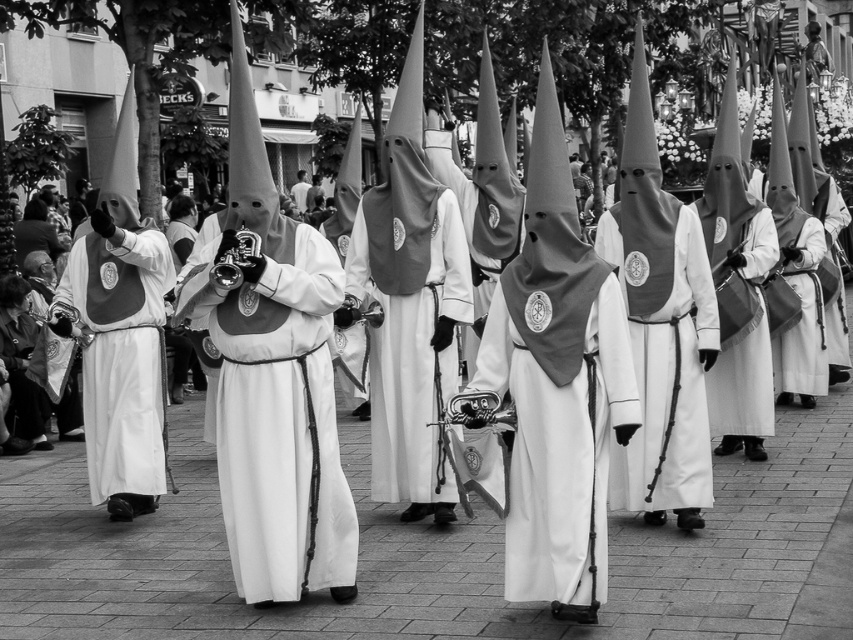
Question: Can you confirm if white matte vest at center is positioned below white fabric at center?

Choices:
 (A) yes
 (B) no

Answer: (A)

Question: Does white matte vest at center appear under white fabric at center?

Choices:
 (A) yes
 (B) no

Answer: (A)

Question: Estimate the real-world distances between objects in this image. Which object is closer to the white matte vest at center?

Choices:
 (A) white matte uniform at center
 (B) white fabric at center

Answer: (A)

Question: Which of the following is the farthest from the observer?

Choices:
 (A) white matte uniform at center
 (B) white fabric at center

Answer: (B)

Question: Can you confirm if white matte vest at center is positioned to the left of white fabric at center?

Choices:
 (A) yes
 (B) no

Answer: (B)

Question: Which object is the closest to the white matte vest at center?

Choices:
 (A) white matte uniform at center
 (B) white fabric at center

Answer: (A)